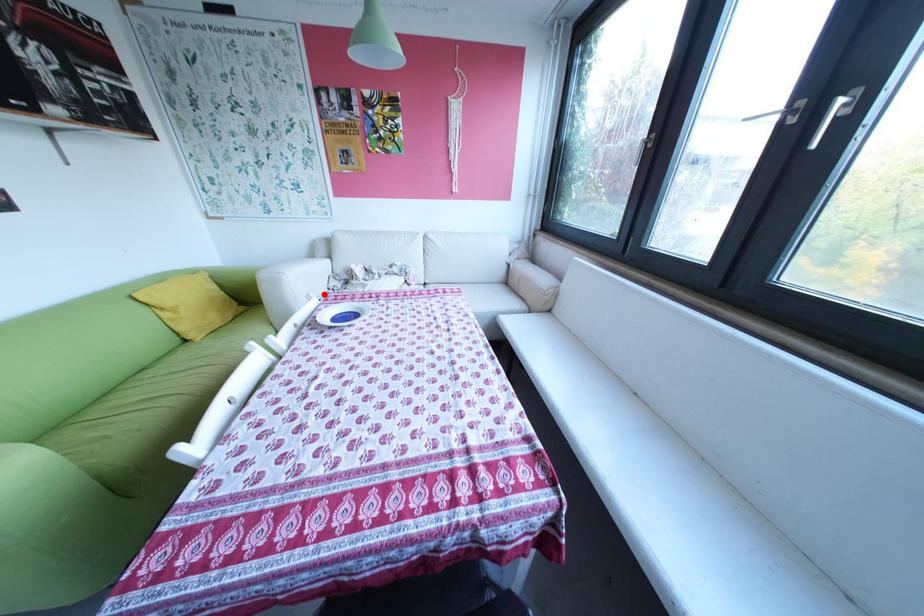
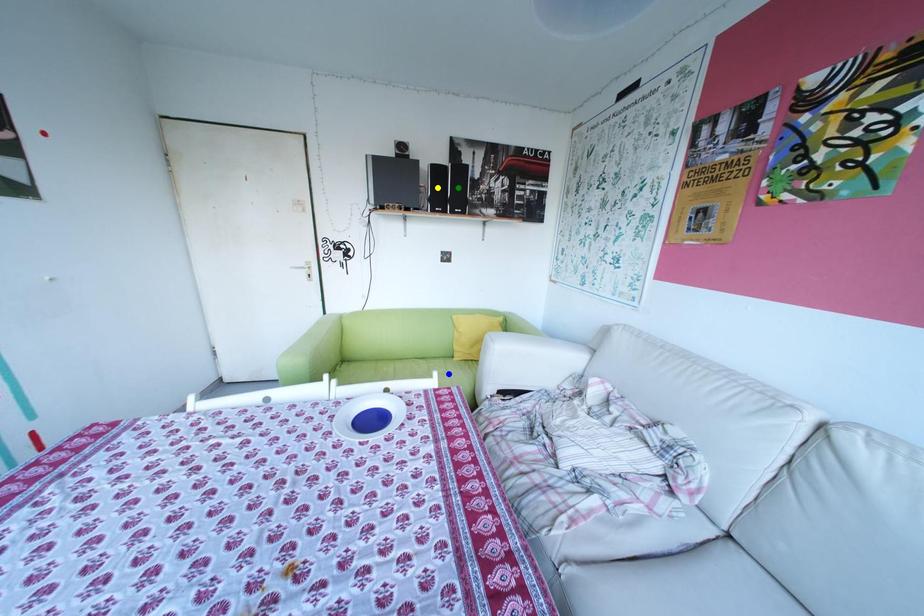
Question: I am providing you with two images of the same scene from different viewpoints. A red point is marked on the first image. You are given multiple points on the second image. In image 2, which mark is for the same physical point as the one in image 1?

Choices:
 (A) blue point
 (B) yellow point
 (C) green point

Answer: (A)